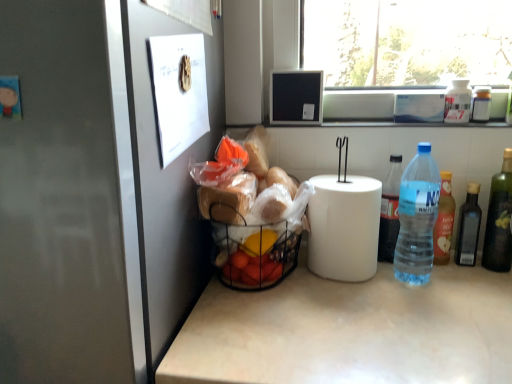
Question: Is green glass bottle at right, which ranks as the seventh bottle in left-to-right order, smaller than clear plastic bottle at right, marked as the sixth bottle in a right-to-left arrangement?

Choices:
 (A) no
 (B) yes

Answer: (B)

Question: Is green glass bottle at right, which ranks as the seventh bottle in left-to-right order, thinner than clear plastic bottle at right, positioned as the 2th bottle in left-to-right order?

Choices:
 (A) no
 (B) yes

Answer: (B)

Question: Does green glass bottle at right, which ranks as the seventh bottle in left-to-right order, appear on the left side of clear plastic bottle at right, positioned as the 2th bottle in left-to-right order?

Choices:
 (A) no
 (B) yes

Answer: (A)

Question: From the image's perspective, is green glass bottle at right, the 1th bottle when ordered from right to left, located above clear plastic bottle at right, marked as the sixth bottle in a right-to-left arrangement?

Choices:
 (A) no
 (B) yes

Answer: (A)

Question: Is green glass bottle at right, which ranks as the seventh bottle in left-to-right order, located outside clear plastic bottle at right, marked as the sixth bottle in a right-to-left arrangement?

Choices:
 (A) no
 (B) yes

Answer: (B)

Question: Considering the positions of point (480, 102) and point (445, 92), is point (480, 102) closer or farther from the camera than point (445, 92)?

Choices:
 (A) closer
 (B) farther

Answer: (A)

Question: From the image's perspective, is white plastic bottle at upper right, the sixth bottle in the left-to-right sequence, above or below white plastic bottle at upper right, acting as the fourth bottle starting from the right?

Choices:
 (A) above
 (B) below

Answer: (B)

Question: Looking at the image, does white plastic bottle at upper right, the sixth bottle in the left-to-right sequence, seem bigger or smaller compared to white plastic bottle at upper right, positioned as the fourth bottle in left-to-right order?

Choices:
 (A) small
 (B) big

Answer: (A)

Question: Considering the positions of white plastic bottle at upper right, which is counted as the 2th bottle, starting from the right, and white plastic bottle at upper right, acting as the fourth bottle starting from the right, in the image, is white plastic bottle at upper right, which is counted as the 2th bottle, starting from the right, taller or shorter than white plastic bottle at upper right, acting as the fourth bottle starting from the right,?

Choices:
 (A) short
 (B) tall

Answer: (A)

Question: From a real-world perspective, is translucent plastic bottle at right, which ranks as the 3th bottle in left-to-right order, positioned above or below dark glass bottle at right, positioned as the 3th bottle in right-to-left order?

Choices:
 (A) below
 (B) above

Answer: (B)

Question: Considering their positions, is translucent plastic bottle at right, marked as the 5th bottle in a right-to-left arrangement, located in front of or behind dark glass bottle at right, placed as the 5th bottle when sorted from left to right?

Choices:
 (A) front
 (B) behind

Answer: (B)

Question: From the image's perspective, is translucent plastic bottle at right, marked as the 5th bottle in a right-to-left arrangement, above or below dark glass bottle at right, positioned as the 3th bottle in right-to-left order?

Choices:
 (A) above
 (B) below

Answer: (A)

Question: Is translucent plastic bottle at right, marked as the 5th bottle in a right-to-left arrangement, bigger or smaller than dark glass bottle at right, positioned as the 3th bottle in right-to-left order?

Choices:
 (A) small
 (B) big

Answer: (B)

Question: Is blue plastic bottle at right, which appears as the seventh bottle when viewed from the right, wider or thinner than dark glass bottle at right, placed as the 5th bottle when sorted from left to right?

Choices:
 (A) wide
 (B) thin

Answer: (A)

Question: From their relative heights in the image, would you say blue plastic bottle at right, which appears as the seventh bottle when viewed from the right, is taller or shorter than dark glass bottle at right, placed as the 5th bottle when sorted from left to right?

Choices:
 (A) tall
 (B) short

Answer: (A)